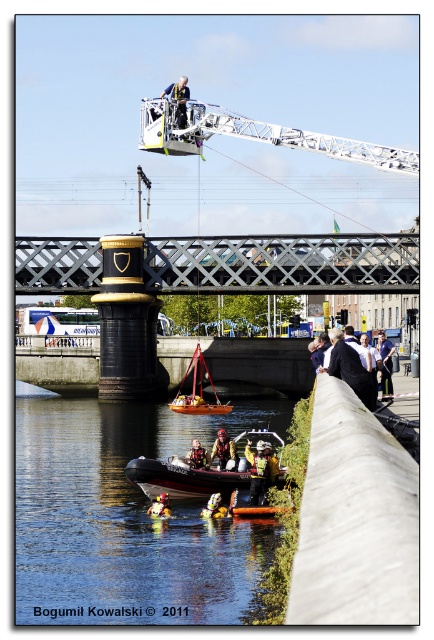
Question: Which of the following is the closest to the observer?

Choices:
 (A) rubber inflatable boat at lower center
 (B) yellow fabric life vest at lower center
 (C) metallic helmet at upper center

Answer: (A)

Question: Which point is closer to the camera?

Choices:
 (A) (203, 451)
 (B) (194, 401)
 (C) (279, 468)

Answer: (C)

Question: Is white metallic crane at upper center positioned in front of black suit at center?

Choices:
 (A) no
 (B) yes

Answer: (A)

Question: Can you confirm if wooden sailboat at center is thinner than red helmet at lower center?

Choices:
 (A) yes
 (B) no

Answer: (B)

Question: Among these objects, which one is farthest from the camera?

Choices:
 (A) reddish-orange helmet at lower center
 (B) metallic helmet at upper center
 (C) white metallic crane at upper center
 (D) smooth black water at lower center

Answer: (B)

Question: Observing the image, what is the correct spatial positioning of metallic helmet at upper center in reference to yellow fabric life vest at lower center?

Choices:
 (A) below
 (B) above

Answer: (B)